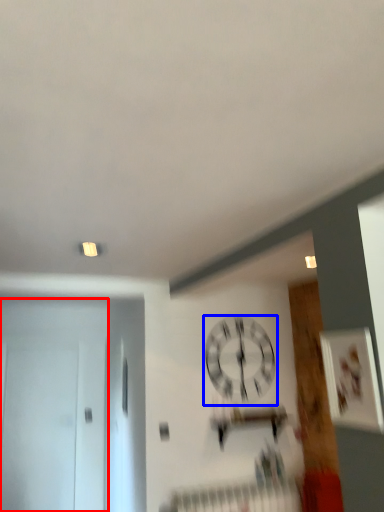
Question: Which point is closer to the camera, door (highlighted by a red box) or wall clock (highlighted by a blue box)?

Choices:
 (A) door
 (B) wall clock

Answer: (B)